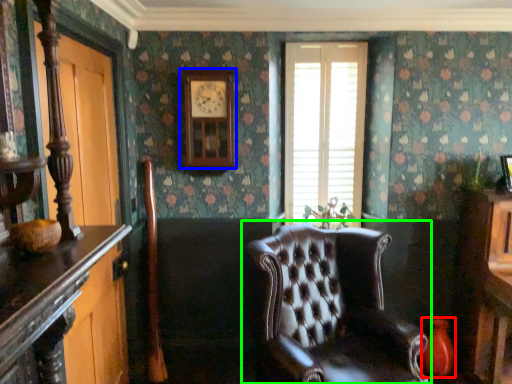
Question: Which is farther away from vase (highlighted by a red box)? clock (highlighted by a blue box) or chair (highlighted by a green box)?

Choices:
 (A) clock
 (B) chair

Answer: (A)